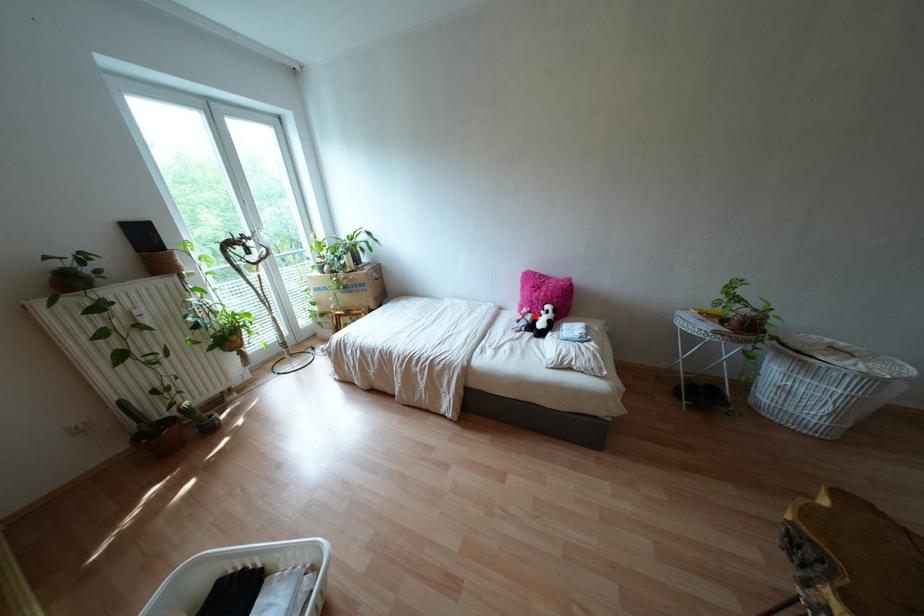
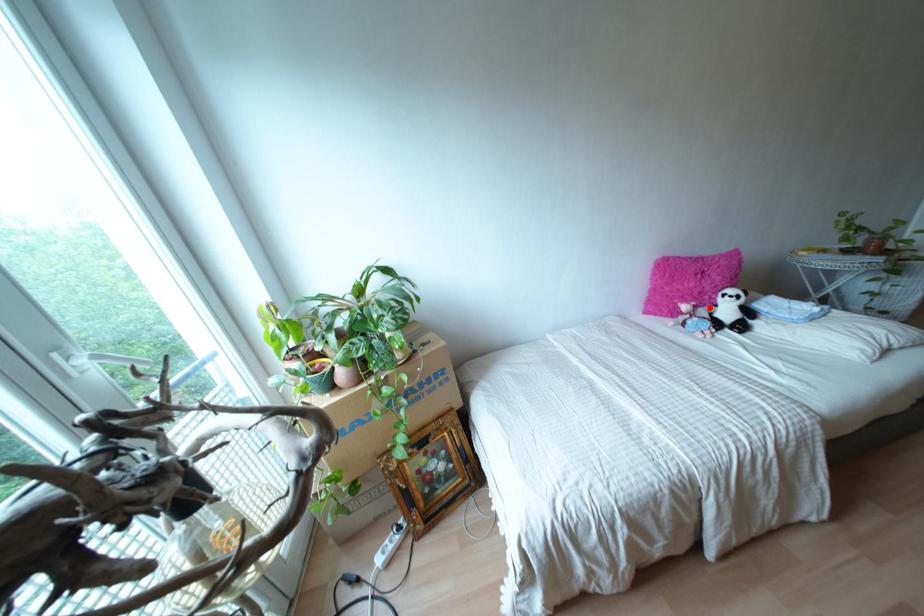
I am providing you with two images of the same scene from different viewpoints. A red point is marked on the first image and another point is marked on the second image. Is the marked point in image1 the same physical position as the marked point in image2?

Yes